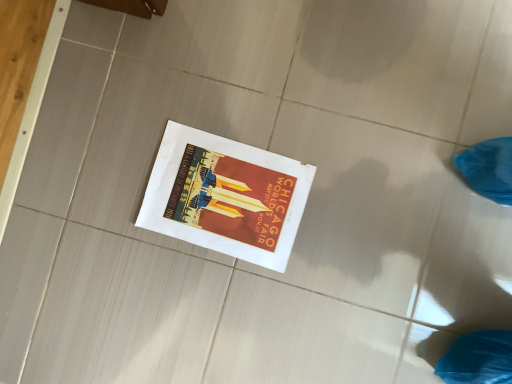
Locate an element on the screen. The height and width of the screenshot is (384, 512). vacant area that lies to the right of white paper poster at center is located at coordinates (311, 112).